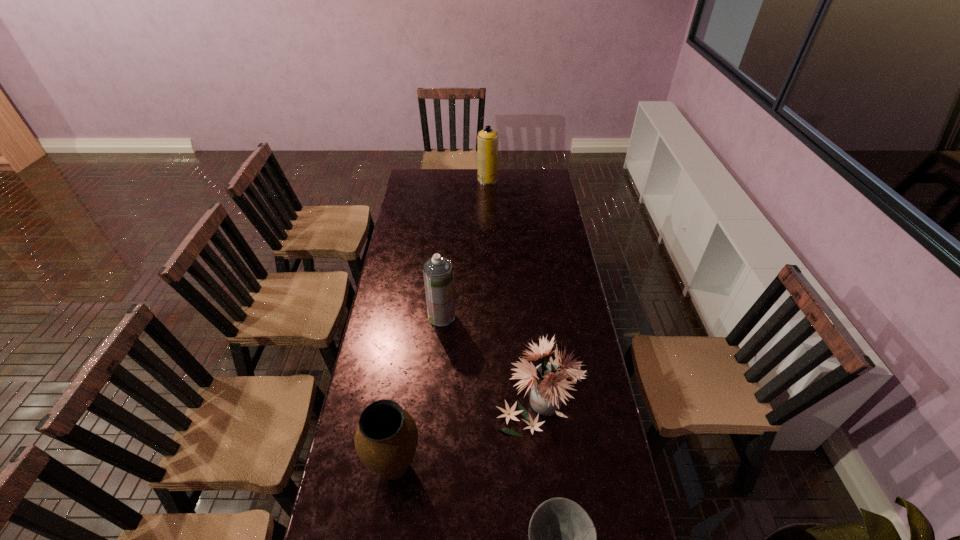
Locate an element on the screen. Image resolution: width=960 pixels, height=540 pixels. the farther aerosol can is located at coordinates point(487,140).

You are a GUI agent. You are given a task and a screenshot of the screen. Output one action in this format:
    pyautogui.click(x=<x>, y=<y>)
    Task: Click on the right aerosol can
    Image resolution: width=960 pixels, height=540 pixels.
    Given the screenshot: What is the action you would take?
    pyautogui.click(x=487, y=140)

Identify the location of the nearer aerosol can. (437, 271).

The width and height of the screenshot is (960, 540). I want to click on the fourth nearest object, so click(437, 271).

This screenshot has width=960, height=540. Identify the location of the third nearest object. (549, 380).

I want to click on urn, so click(386, 437).

Where is `blank space located 0.190m on the left of the right aerosol can`? The width and height of the screenshot is (960, 540). blank space located 0.190m on the left of the right aerosol can is located at coordinates (445, 180).

Identify the location of free point located 0.220m on the right of the left aerosol can. The image size is (960, 540). (509, 316).

Locate an element on the screen. This screenshot has width=960, height=540. vacant area situated on the left of the bouquet is located at coordinates (416, 393).

Locate an element on the screen. This screenshot has height=540, width=960. free space located on the right of the second nearest object is located at coordinates (459, 467).